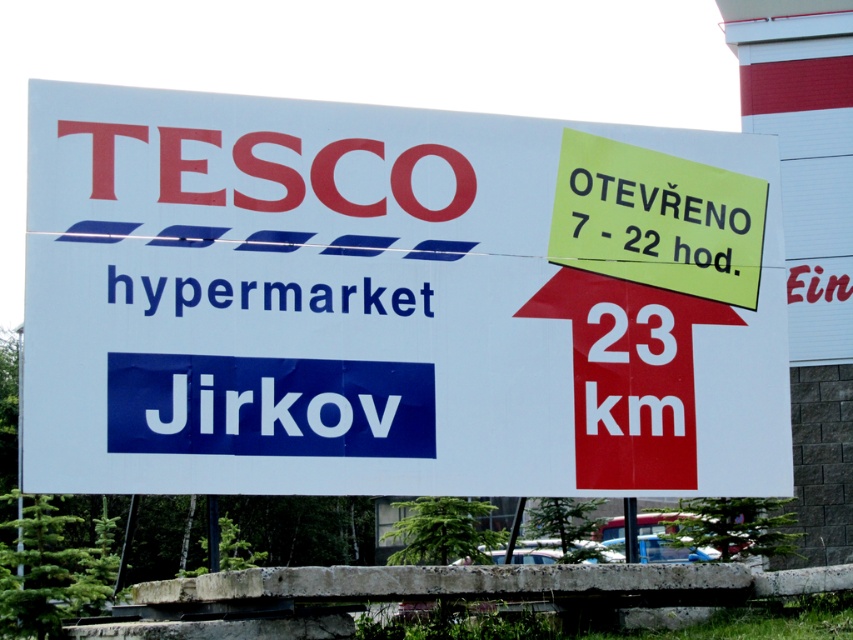
Does white paper sign at center have a smaller size compared to yellow paper sign at upper right?

Actually, white paper sign at center might be larger than yellow paper sign at upper right.

Who is lower down, white paper sign at center or yellow paper sign at upper right?

white paper sign at center is lower down.

What do you see at coordinates (396, 301) in the screenshot? I see `white paper sign at center` at bounding box center [396, 301].

Locate an element on the screen. white paper sign at center is located at coordinates (396, 301).